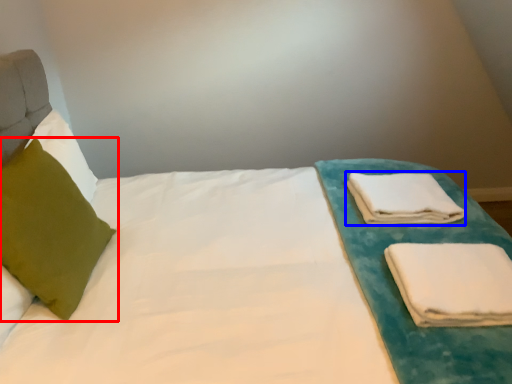
Question: Which of the following is the closest to the observer, pillow (highlighted by a red box) or cloth (highlighted by a blue box)?

Choices:
 (A) pillow
 (B) cloth

Answer: (A)